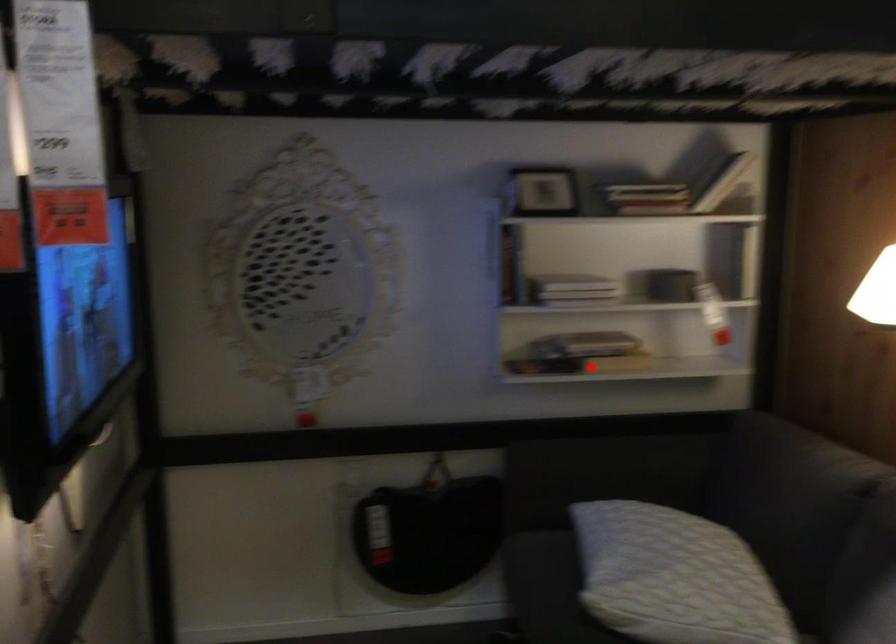
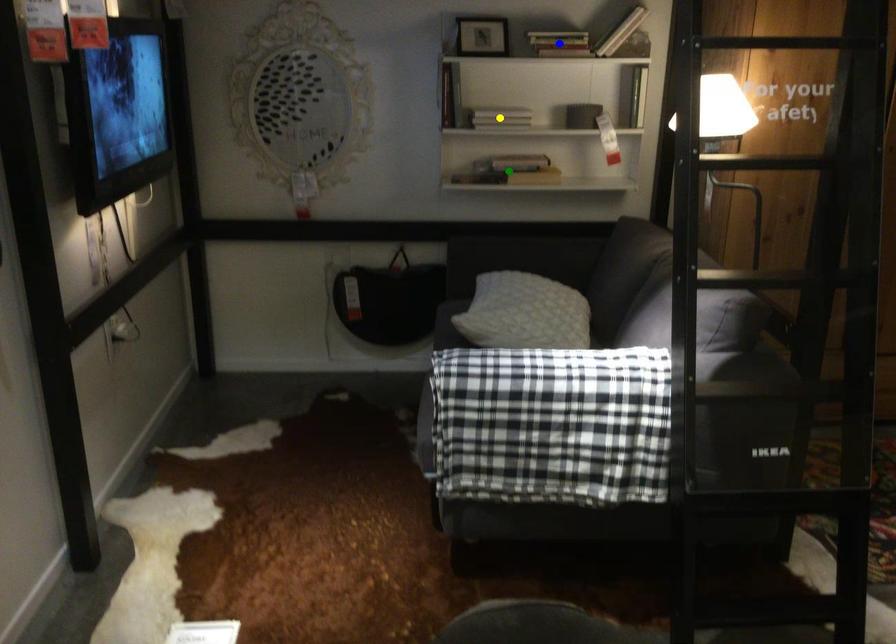
Question: I am providing you with two images of the same scene from different viewpoints. A red point is marked on the first image. You are given multiple points on the second image. Which spot in image 2 lines up with the point in image 1?

Choices:
 (A) blue point
 (B) green point
 (C) yellow point

Answer: (B)